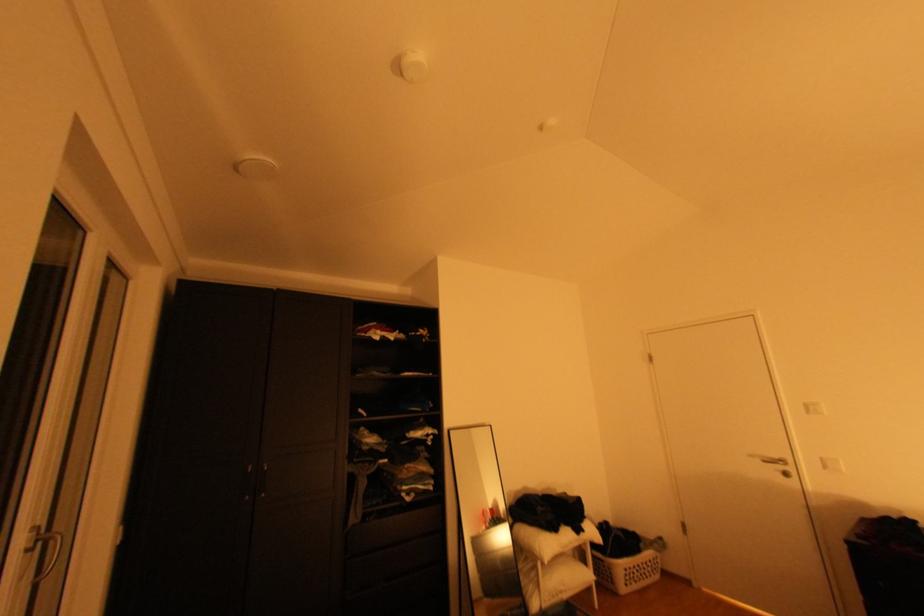
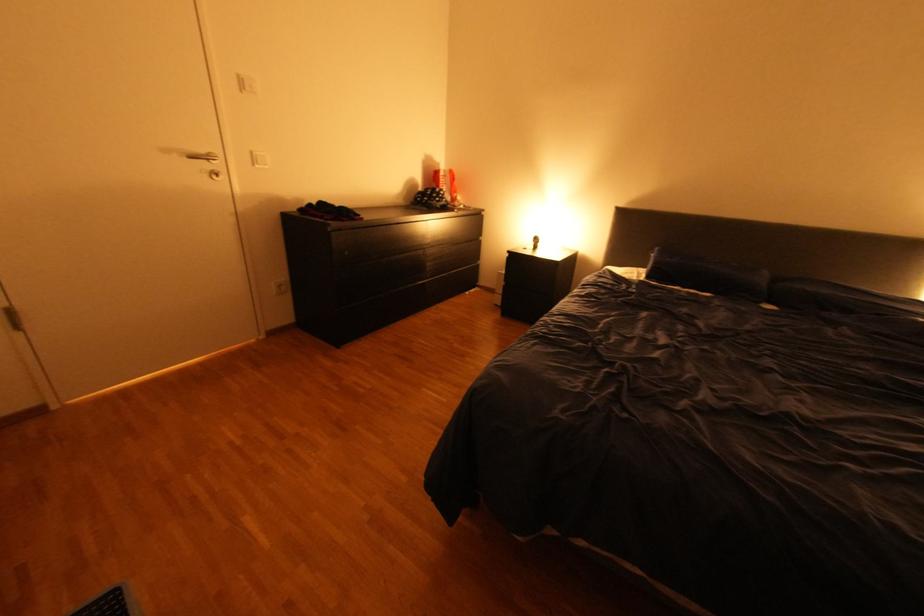
In the second image, find the point that corresponds to point (786, 456) in the first image.

(213, 151)